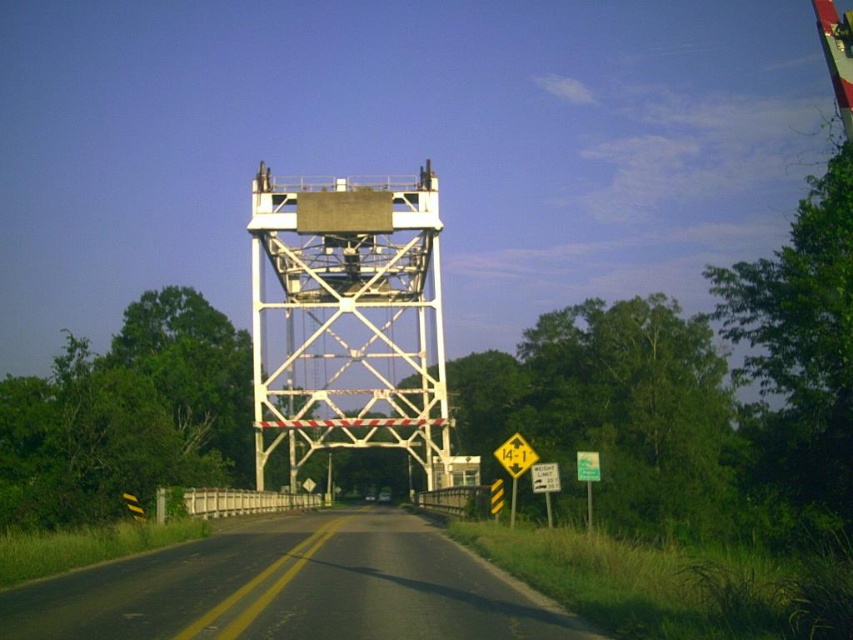
You are standing on the rural road and see a white metallic tower at center. There is a point at coordinates point (347, 321). Is this point located on the white metallic tower at center?

Yes, the point (347, 321) is on the white metallic tower at center according to the description.

You are a driver approaching the white metallic tower at center and the yellow reflective plastic triangle at center on the rural road. Which object will you see first as you drive towards them?

The white metallic tower at center is closer to you than the yellow reflective plastic triangle at center, so you will see the white metallic tower at center first as you drive towards them.